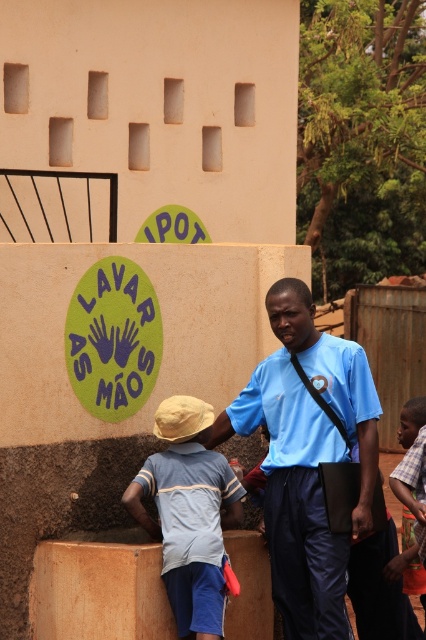
Question: Is blue fabric shirt at center in front of light blue fabric shirt at lower left?

Choices:
 (A) yes
 (B) no

Answer: (B)

Question: Can you confirm if blue fabric shirt at center is thinner than light blue fabric shirt at lower left?

Choices:
 (A) yes
 (B) no

Answer: (B)

Question: Among these objects, which one is farthest from the camera?

Choices:
 (A) blue fabric shirt at center
 (B) plaid fabric shirt at right

Answer: (B)

Question: Based on their relative distances, which object is farther from the blue fabric shirt at center?

Choices:
 (A) light blue fabric shirt at lower left
 (B) plaid fabric shirt at right

Answer: (B)

Question: Which of the following is the closest to the observer?

Choices:
 (A) (422, 570)
 (B) (336, 385)
 (C) (172, 518)

Answer: (C)

Question: In this image, where is blue fabric shirt at center located relative to light blue fabric shirt at lower left?

Choices:
 (A) above
 (B) below

Answer: (A)